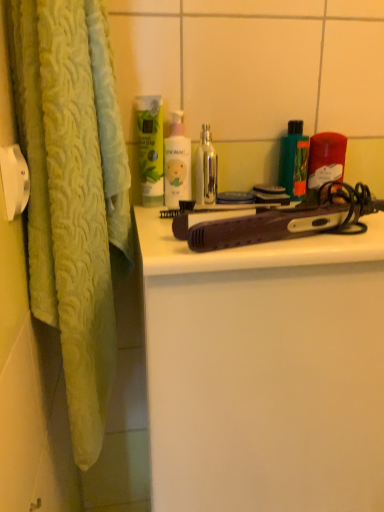
Question: Does green matte bottle at upper right, arranged as the 2th product when viewed from the right, appear on the left side of translucent plastic container at upper right, the second product when ordered from left to right?

Choices:
 (A) no
 (B) yes

Answer: (B)

Question: Is green matte bottle at upper right, arranged as the 2th product when viewed from the right, bigger than translucent plastic container at upper right, which ranks as the 1th product in right-to-left order?

Choices:
 (A) no
 (B) yes

Answer: (A)

Question: Is green matte bottle at upper right, which appears as the first product when viewed from the left, thinner than translucent plastic container at upper right, the second product when ordered from left to right?

Choices:
 (A) no
 (B) yes

Answer: (B)

Question: From a real-world perspective, does green matte bottle at upper right, arranged as the 2th product when viewed from the right, sit lower than translucent plastic container at upper right, which ranks as the 1th product in right-to-left order?

Choices:
 (A) no
 (B) yes

Answer: (A)

Question: Are green matte bottle at upper right, arranged as the 2th product when viewed from the right, and translucent plastic container at upper right, which ranks as the 1th product in right-to-left order, beside each other?

Choices:
 (A) yes
 (B) no

Answer: (A)

Question: From the image's perspective, is green matte bottle at upper right, arranged as the 2th product when viewed from the right, positioned above or below white matte bottle at center, which is counted as the first cleaning product, starting from the right?

Choices:
 (A) below
 (B) above

Answer: (B)

Question: Looking at their shapes, would you say green matte bottle at upper right, arranged as the 2th product when viewed from the right, is wider or thinner than white matte bottle at center, the 2th cleaning product when ordered from left to right?

Choices:
 (A) wide
 (B) thin

Answer: (B)

Question: Is point (291, 123) positioned closer to the camera than point (165, 196)?

Choices:
 (A) closer
 (B) farther

Answer: (B)

Question: In the image, is green matte bottle at upper right, which appears as the first product when viewed from the left, on the left side or the right side of white matte bottle at center, the 2th cleaning product when ordered from left to right?

Choices:
 (A) left
 (B) right

Answer: (B)

Question: From the image's perspective, is green matte bottle at upper right, arranged as the 2th product when viewed from the right, above or below green matte lotion at upper center, which is the second cleaning product in right-to-left order?

Choices:
 (A) below
 (B) above

Answer: (A)

Question: Looking at their shapes, would you say green matte bottle at upper right, arranged as the 2th product when viewed from the right, is wider or thinner than green matte lotion at upper center, which is the 1th cleaning product in left-to-right order?

Choices:
 (A) wide
 (B) thin

Answer: (A)

Question: Considering the positions of point (296, 196) and point (142, 136), is point (296, 196) closer or farther from the camera than point (142, 136)?

Choices:
 (A) farther
 (B) closer

Answer: (A)

Question: In the image, is green matte bottle at upper right, which appears as the first product when viewed from the left, on the left side or the right side of green matte lotion at upper center, which is the 1th cleaning product in left-to-right order?

Choices:
 (A) right
 (B) left

Answer: (A)

Question: From the image's perspective, is metallic silver bottle at center positioned above or below purple plastic hair straightener at center?

Choices:
 (A) below
 (B) above

Answer: (B)

Question: Visually, is metallic silver bottle at center positioned to the left or to the right of purple plastic hair straightener at center?

Choices:
 (A) left
 (B) right

Answer: (A)